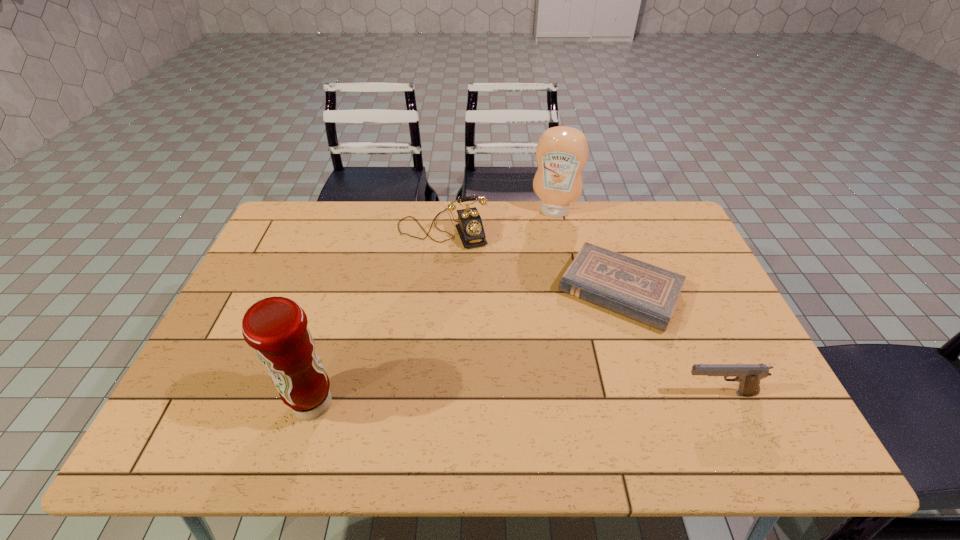
Find the location of a particular element. condiment that is at the far edge is located at coordinates (562, 152).

This screenshot has height=540, width=960. In order to click on telephone located in the far edge section of the desktop in this screenshot , I will do `click(470, 228)`.

This screenshot has width=960, height=540. Find the location of `condiment at the near edge`. condiment at the near edge is located at coordinates (276, 327).

At what (x,y) coordinates should I click in order to perform the action: click on pistol located in the near edge section of the desktop. Please return your answer as a coordinate pair (x, y). Image resolution: width=960 pixels, height=540 pixels. Looking at the image, I should click on (748, 375).

Locate an element on the screen. This screenshot has height=540, width=960. pistol situated at the right edge is located at coordinates (748, 375).

Find the location of `Bible positioned at the right edge`. Bible positioned at the right edge is located at coordinates (638, 290).

Identify the location of object that is at the near right corner. The width and height of the screenshot is (960, 540). (748, 375).

You are a GUI agent. You are given a task and a screenshot of the screen. Output one action in this format:
    pyautogui.click(x=<x>, y=<y>)
    Task: Click on the free region at the far edge of the desktop
    The image size is (960, 540).
    Given the screenshot: What is the action you would take?
    pyautogui.click(x=519, y=221)

In order to click on vacant space at the near edge of the desktop in this screenshot , I will do (343, 396).

At what (x,y) coordinates should I click in order to perform the action: click on vacant space at the left edge of the desktop. Please return your answer as a coordinate pair (x, y). The width and height of the screenshot is (960, 540). Looking at the image, I should click on (247, 292).